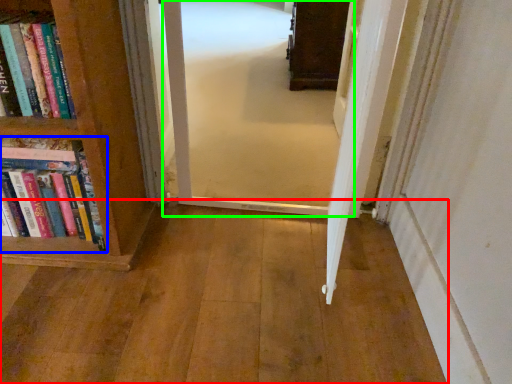
Question: Which object is the closest to the corridor (highlighted by a red box)? Choose among these: book (highlighted by a blue box) or corridor (highlighted by a green box).

Choices:
 (A) book
 (B) corridor

Answer: (A)